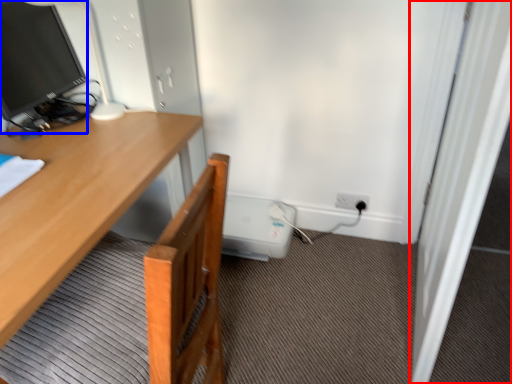
Question: Among these objects, which one is nearest to the camera, screen door (highlighted by a red box) or television (highlighted by a blue box)?

Choices:
 (A) screen door
 (B) television

Answer: (A)